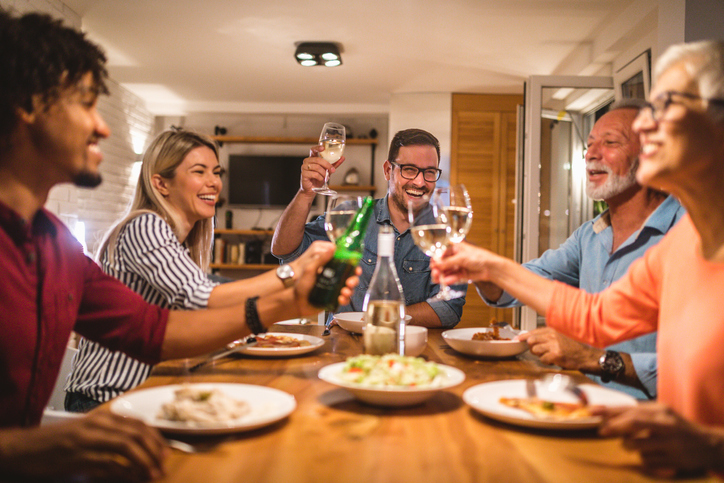
Identify the location of wine glasses. The height and width of the screenshot is (483, 724). (342, 213), (327, 143), (424, 235), (460, 214).